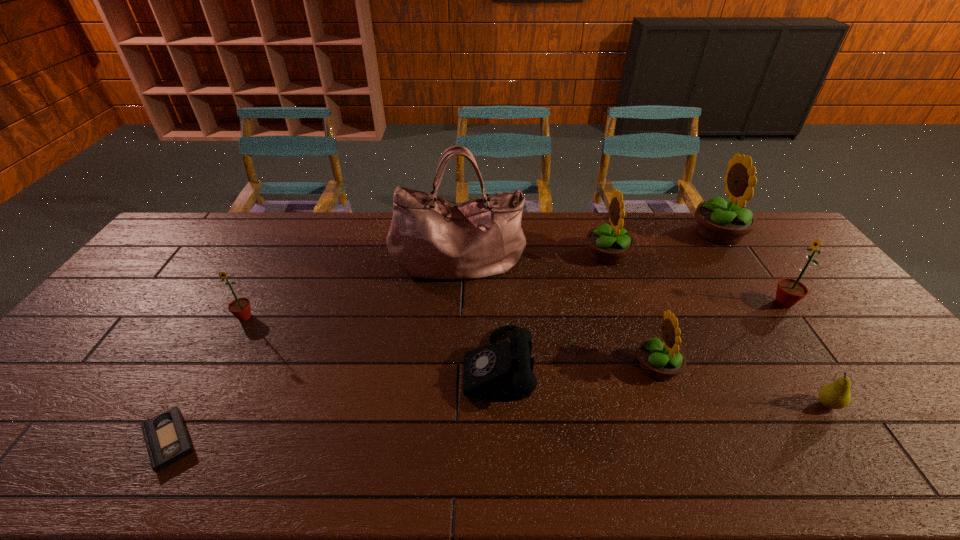
Where is `unoccupied area between the pear and the bigger green sunflower`? The image size is (960, 540). unoccupied area between the pear and the bigger green sunflower is located at coordinates (805, 354).

Locate an element on the screen. free space between the smaller green sunflower and the telephone is located at coordinates (372, 342).

Find the location of a particular element. The width and height of the screenshot is (960, 540). free space between the smaller green sunflower and the bigger green sunflower is located at coordinates (514, 310).

You are a GUI agent. You are given a task and a screenshot of the screen. Output one action in this format:
    pyautogui.click(x=<x>, y=<y>)
    Task: Click on the blank region between the handbag and the videotape
    
    Given the screenshot: What is the action you would take?
    pyautogui.click(x=313, y=352)

Locate an element on the screen. This screenshot has width=960, height=540. vacant area that lies between the telephone and the smaller green sunflower is located at coordinates (372, 342).

Identify the location of vacant space in between the telephone and the tallest object. click(x=478, y=315).

Find the location of a particular element. This screenshot has height=540, width=960. empty space that is in between the tallest object and the rightmost yellow sunflower is located at coordinates (588, 248).

This screenshot has width=960, height=540. I want to click on free space between the pear and the leftmost sunflower, so click(536, 361).

Locate an element on the screen. Image resolution: width=960 pixels, height=540 pixels. free space between the pear and the smallest yellow sunflower is located at coordinates (742, 386).

Locate an element on the screen. the seventh closest object to the right green sunflower is located at coordinates (240, 308).